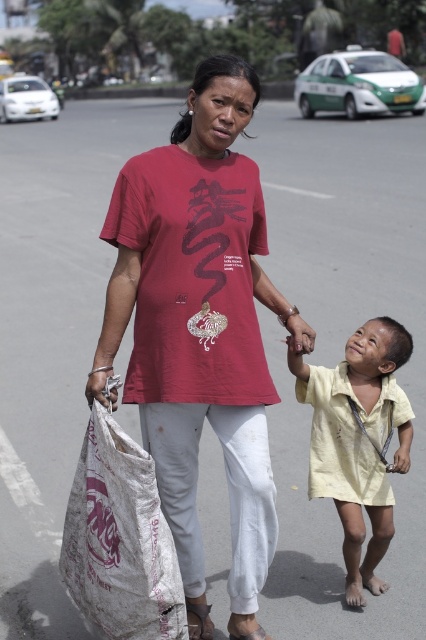
Question: Which point is closer to the camera taking this photo?

Choices:
 (A) (158, 195)
 (B) (374, 561)

Answer: (A)

Question: Does matte red t-shirt at center have a larger size compared to white woven bag at lower left?

Choices:
 (A) no
 (B) yes

Answer: (B)

Question: Which object is farther from the camera taking this photo?

Choices:
 (A) white woven bag at lower left
 (B) yellow cotton shirt at lower right
 (C) matte red t-shirt at center

Answer: (B)

Question: Is matte red t-shirt at center above yellow cotton shirt at lower right?

Choices:
 (A) no
 (B) yes

Answer: (B)

Question: Is white woven bag at lower left positioned before yellow cotton shirt at lower right?

Choices:
 (A) no
 (B) yes

Answer: (B)

Question: Which object appears farthest from the camera in this image?

Choices:
 (A) yellow cotton shirt at lower right
 (B) white woven bag at lower left

Answer: (A)